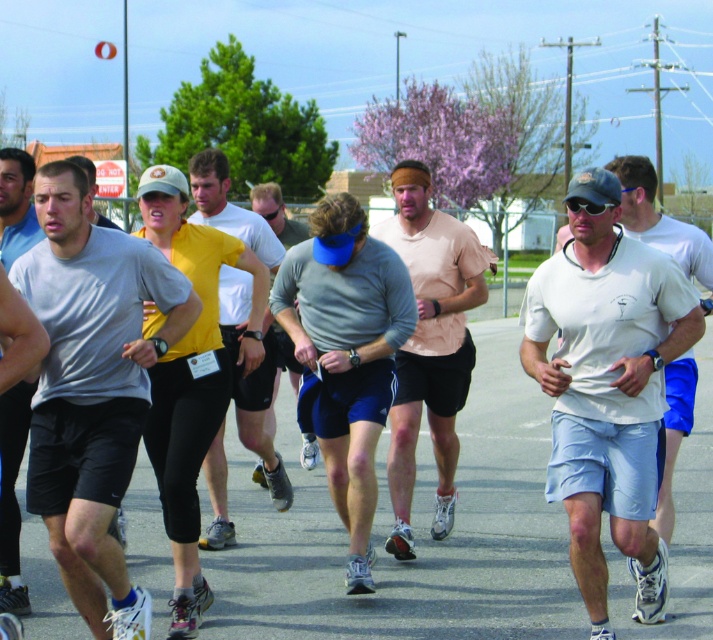
How much distance is there between light pink t-shirt at center and gray cotton shirt at center?

The distance of light pink t-shirt at center from gray cotton shirt at center is 7.59 feet.

Which of these two, light pink t-shirt at center or gray cotton shirt at center, stands taller?

Standing taller between the two is light pink t-shirt at center.

This screenshot has height=640, width=713. Identify the location of light pink t-shirt at center. (430, 344).

The width and height of the screenshot is (713, 640). I want to click on light pink t-shirt at center, so click(x=430, y=344).

In the scene shown: Does white matte t-shirt at center have a lesser height compared to light pink t-shirt at center?

Yes.

Between white matte t-shirt at center and light pink t-shirt at center, which one is positioned lower?

Answer: white matte t-shirt at center is lower down.

Which is behind, point (630, 458) or point (451, 419)?

Point (451, 419)

I want to click on white matte t-shirt at center, so click(607, 387).

Describe the element at coordinates (92, 388) in the screenshot. I see `gray matte t-shirt at center` at that location.

Does point (113, 420) lie in front of point (430, 378)?

Yes, point (113, 420) is in front of point (430, 378).

What are the coordinates of `gray matte t-shirt at center` in the screenshot? It's located at (92, 388).